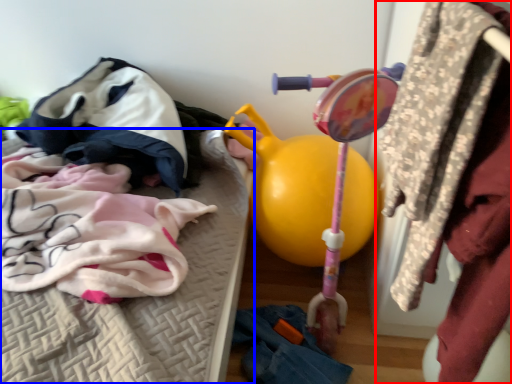
Question: Which of the following is the farthest to the observer, closet (highlighted by a red box) or furniture (highlighted by a blue box)?

Choices:
 (A) closet
 (B) furniture

Answer: (B)